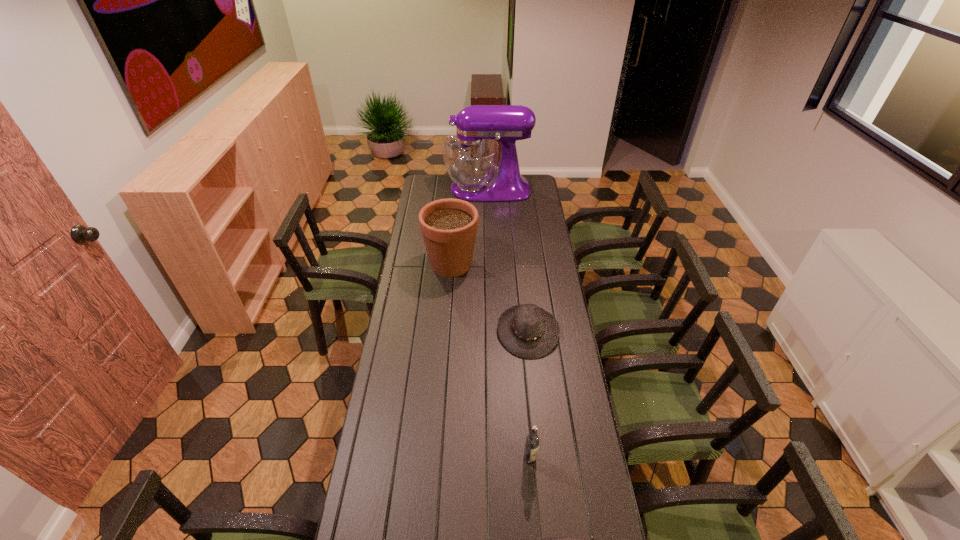
I want to click on object that is at the far right corner, so pos(470,157).

You are a GUI agent. You are given a task and a screenshot of the screen. Output one action in this format:
    pyautogui.click(x=<x>, y=<y>)
    Task: Click on the vacant region at the left edge
    The height and width of the screenshot is (540, 960).
    Given the screenshot: What is the action you would take?
    pyautogui.click(x=411, y=226)

Locate an element on the screen. free space at the right edge is located at coordinates (561, 339).

What are the coordinates of `vacant area that lies between the farther hat and the farthest object` in the screenshot? It's located at (508, 260).

Where is `vacant area that lies between the third farthest object and the third shortest object`? vacant area that lies between the third farthest object and the third shortest object is located at coordinates (529, 395).

Locate an element on the screen. empty space that is in between the third nearest object and the second tallest object is located at coordinates (490, 298).

Locate which object is the fourth closest to the mixer. Please provide its 2D coordinates. Your answer should be formatted as a tuple, i.e. [(x, y)], where the tuple contains the x and y coordinates of a point satisfying the conditions above.

[(567, 539)]

Select which object is the fourth closest to the farther hat. Please provide its 2D coordinates. Your answer should be formatted as a tuple, i.e. [(x, y)], where the tuple contains the x and y coordinates of a point satisfying the conditions above.

[(470, 157)]

Where is `free location that satisfies the following two spatial constraints: 1. on the front-facing side of the taller hat; 2. on the label of the vodka`? The image size is (960, 540). free location that satisfies the following two spatial constraints: 1. on the front-facing side of the taller hat; 2. on the label of the vodka is located at coordinates (541, 459).

The width and height of the screenshot is (960, 540). In order to click on free space that satisfies the following two spatial constraints: 1. on the front-facing side of the taller hat; 2. on the label of the vodka in this screenshot , I will do `click(541, 459)`.